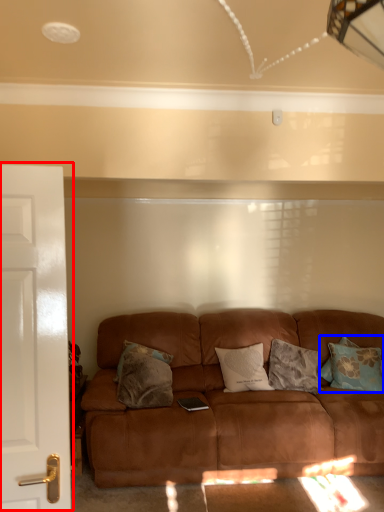
Question: Which of the following is the farthest to the observer, door (highlighted by a red box) or pillow (highlighted by a blue box)?

Choices:
 (A) door
 (B) pillow

Answer: (B)